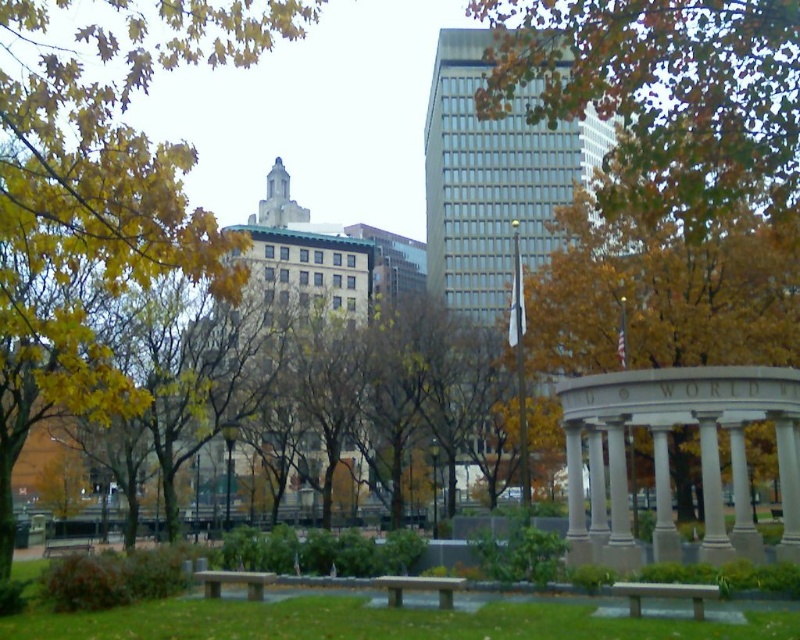
Question: Observing the image, what is the correct spatial positioning of green leafy tree at upper center in reference to smooth concrete bench at lower center?

Choices:
 (A) below
 (B) above

Answer: (B)

Question: Which is farther from the smooth concrete bench at lower center?

Choices:
 (A) stone bench at center
 (B) wooden bench at center
 (C) yellow leafy tree at center

Answer: (C)

Question: Which point appears farthest from the camera in this image?

Choices:
 (A) (664, 204)
 (B) (49, 550)
 (C) (254, 572)
 (D) (766, 371)

Answer: (B)

Question: In this image, where is yellow leafy tree at center located relative to white marble gazebo at center?

Choices:
 (A) below
 (B) above

Answer: (B)

Question: Which point is closer to the camera?

Choices:
 (A) (552, 10)
 (B) (794, 516)
 (C) (660, 588)

Answer: (A)

Question: Is the position of yellow leafy tree at upper left more distant than that of white marble gazebo at center?

Choices:
 (A) yes
 (B) no

Answer: (B)